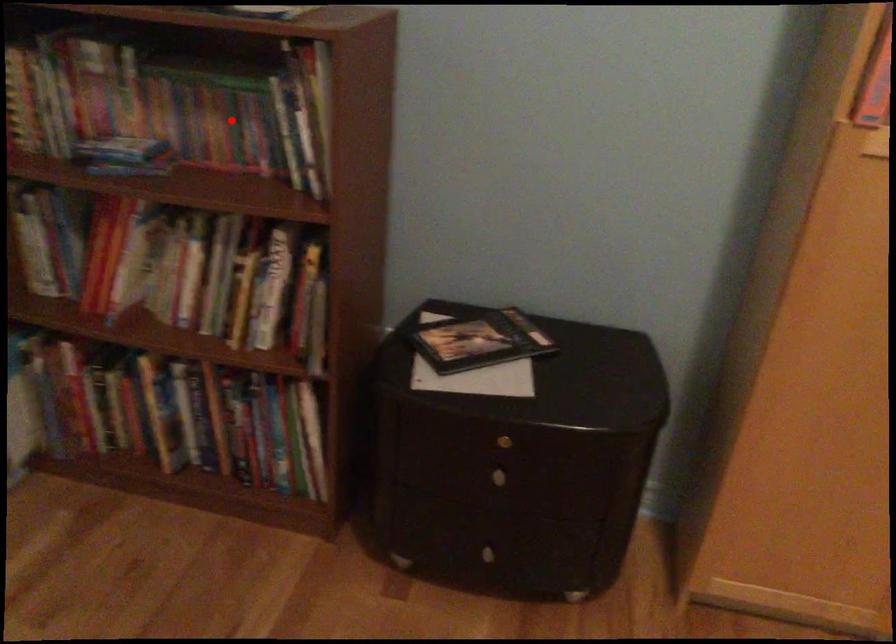
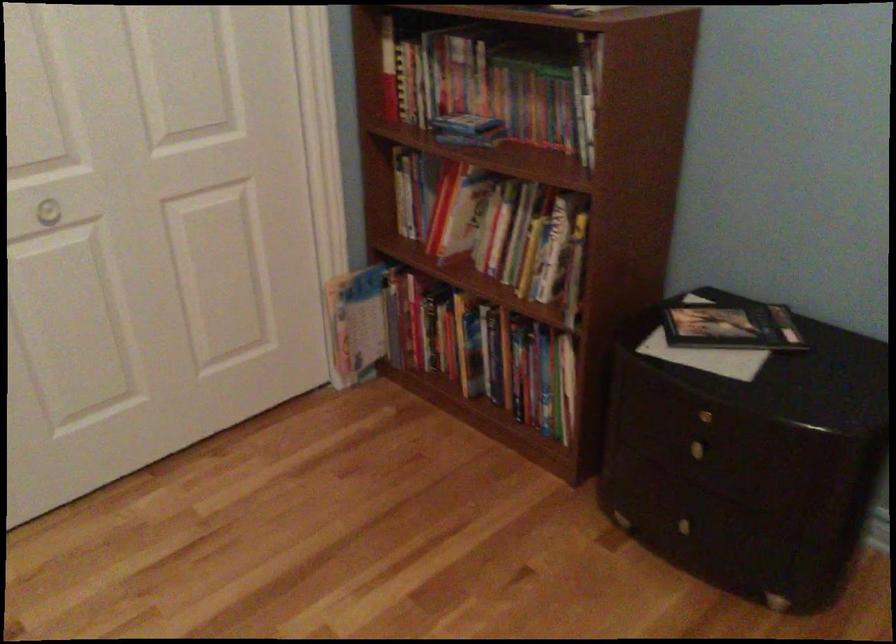
The point at the highlighted location is marked in the first image. Where is the corresponding point in the second image?

(545, 102)